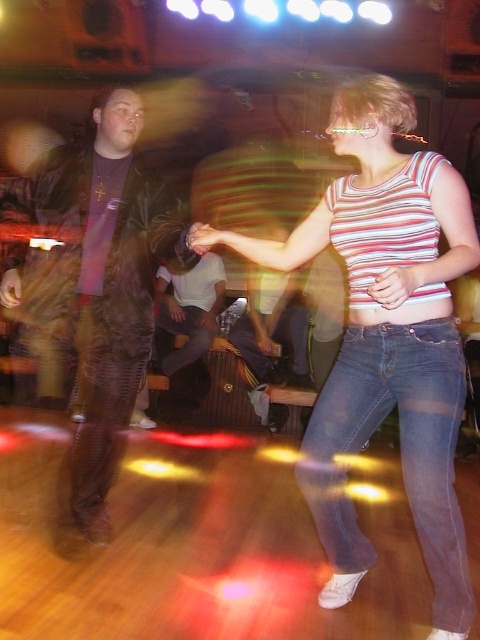
Who is positioned more to the right, striped fabric tank top at center or leather jacket at left?

From the viewer's perspective, striped fabric tank top at center appears more on the right side.

Can you confirm if striped fabric tank top at center is positioned below leather jacket at left?

Indeed, striped fabric tank top at center is positioned under leather jacket at left.

Between point (336, 202) and point (73, 400), which one is positioned in front?

Point (336, 202)

In order to click on striped fabric tank top at center in this screenshot , I will do `click(385, 339)`.

Find the location of a particular element. leather jacket at left is located at coordinates pos(94,288).

From the picture: Which is more to the left, leather jacket at left or denim jeans at center?

Positioned to the left is leather jacket at left.

Is point (64, 216) more distant than point (442, 538)?

Yes, point (64, 216) is behind point (442, 538).

Locate an element on the screen. The image size is (480, 640). leather jacket at left is located at coordinates (94, 288).

Which is behind, point (347, 563) or point (323, 438)?

The point (347, 563) is more distant.

Is striped fabric tank top at center below denim jeans at center?

Incorrect, striped fabric tank top at center is not positioned below denim jeans at center.

Is point (337, 592) farther from viewer compared to point (346, 520)?

Yes.

What are the coordinates of `striped fabric tank top at center` in the screenshot? It's located at (385, 339).